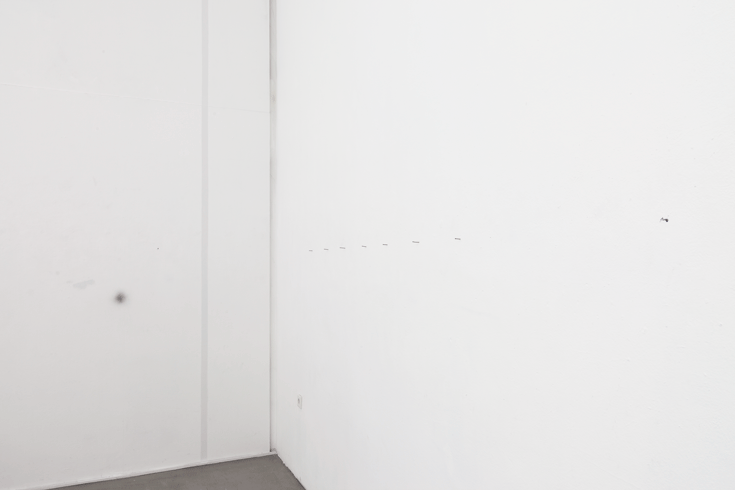
Find the location of a particular element. corner is located at coordinates (276, 452).